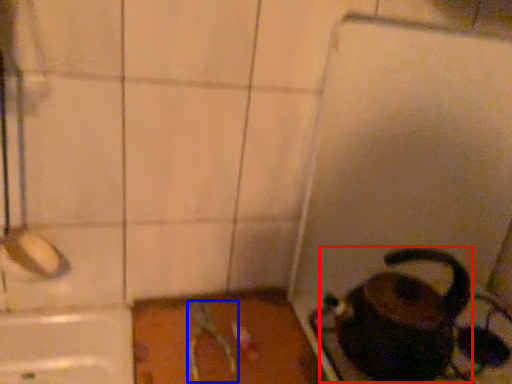
Question: Which point is further to the camera, coffeepot (highlighted by a red box) or scissors (highlighted by a blue box)?

Choices:
 (A) coffeepot
 (B) scissors

Answer: (B)